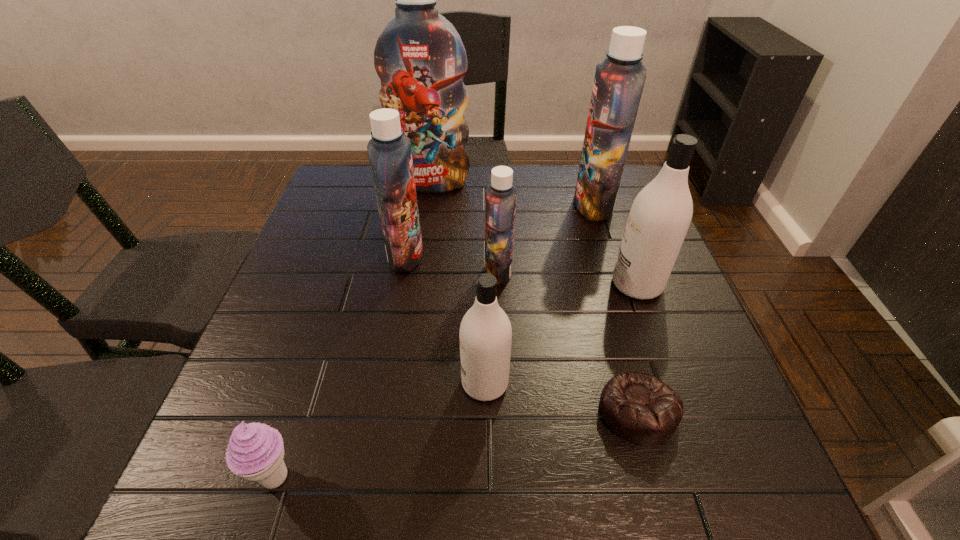
You are a GUI agent. You are given a task and a screenshot of the screen. Output one action in this format:
    pyautogui.click(x=<x>, y=<y>)
    Task: Click on the object that is positioned at the near edge
    This screenshot has height=540, width=960.
    Given the screenshot: What is the action you would take?
    pyautogui.click(x=255, y=452)

You are a GUI agent. You are given a task and a screenshot of the screen. Output one action in this format:
    pyautogui.click(x=<x>, y=<y>)
    Task: Click on the object positioned at the left edge
    This screenshot has width=960, height=540.
    Given the screenshot: What is the action you would take?
    pyautogui.click(x=255, y=452)

Image resolution: width=960 pixels, height=540 pixels. What are the coordinates of `beanbag located at the right edge` in the screenshot? It's located at (640, 408).

Where is `object present at the near left corner`? The height and width of the screenshot is (540, 960). object present at the near left corner is located at coordinates (255, 452).

You are a GUI agent. You are given a task and a screenshot of the screen. Output one action in this format:
    pyautogui.click(x=<x>, y=<y>)
    Task: Click on the object present at the far right corner
    The image size is (960, 540).
    Given the screenshot: What is the action you would take?
    pyautogui.click(x=619, y=81)

The image size is (960, 540). In the image, there is a desktop. Find the location of `free space at the left edge`. free space at the left edge is located at coordinates (362, 224).

Locate an element on the screen. vacant position at the right edge of the desktop is located at coordinates (698, 383).

Find the location of a particular element. Image resolution: width=960 pixels, height=540 pixels. vacant space at the far left corner of the desktop is located at coordinates (340, 179).

This screenshot has height=540, width=960. Find the location of `vacant space at the near left corner of the desktop`. vacant space at the near left corner of the desktop is located at coordinates (274, 492).

What are the coordinates of `free spot between the third blue shampoo from left to right and the leftmost object` in the screenshot? It's located at (387, 374).